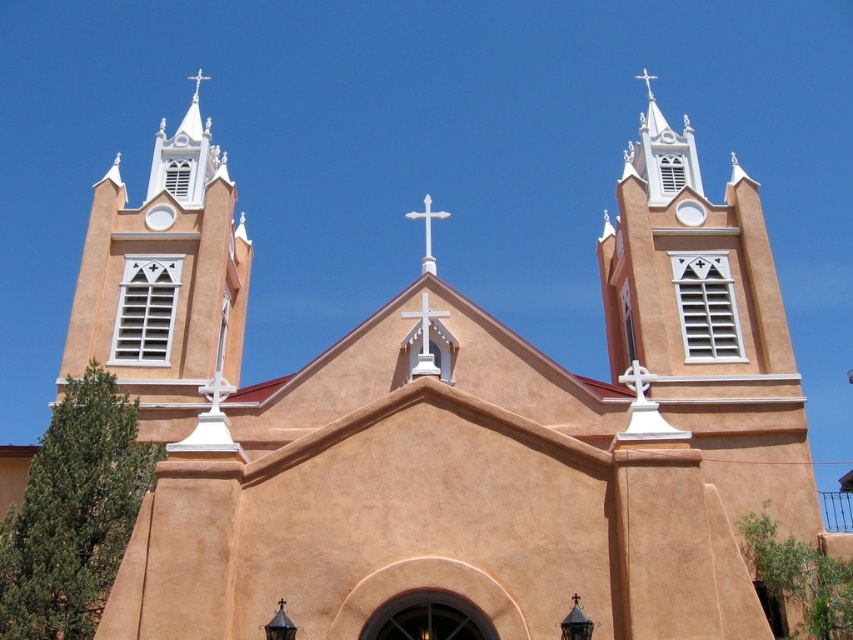
You are standing in front of the church and want to place a new decoration between the white stucco tower at upper left and the white matte cross at center. Based on their positions, where should you place the decoration?

The white stucco tower at upper left is located above the white matte cross at center, so you should place the decoration between them in the space below the tower and above the cross.

You are standing in front of the church and want to take a photo of the white stucco tower at upper left. If your camera can focus on objects up to 40 meters away, will it be able to capture the tower clearly?

The white stucco tower at upper left is 39.76 meters away from the camera, which is within the camera focus range of up to 40 meters. Therefore, the camera can capture the tower clearly.

You are an architect evaluating the church facade. You notice the white stucco tower at upper left and the white matte cross at center. Which of these two elements is bigger in size?

The white stucco tower at upper left is larger in size than the white matte cross at center.